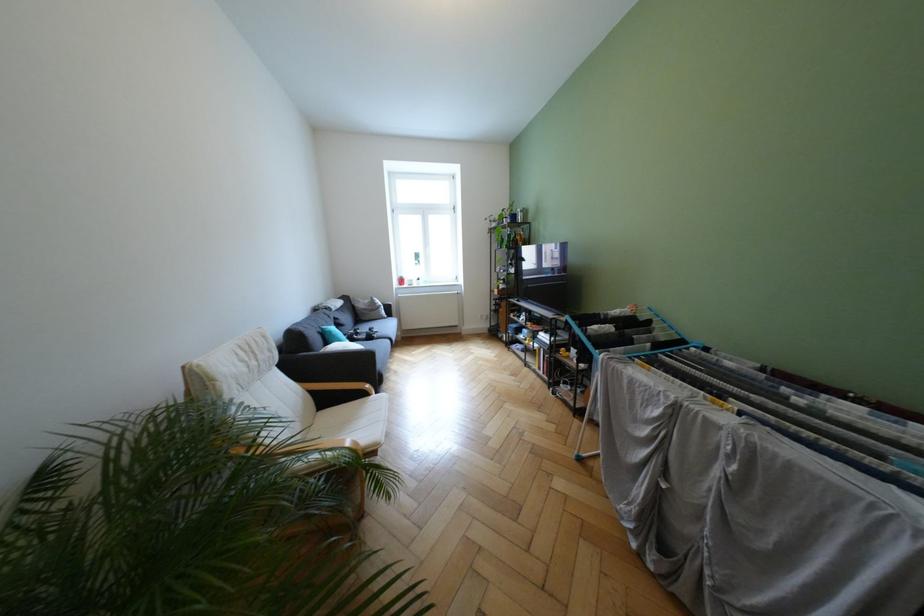
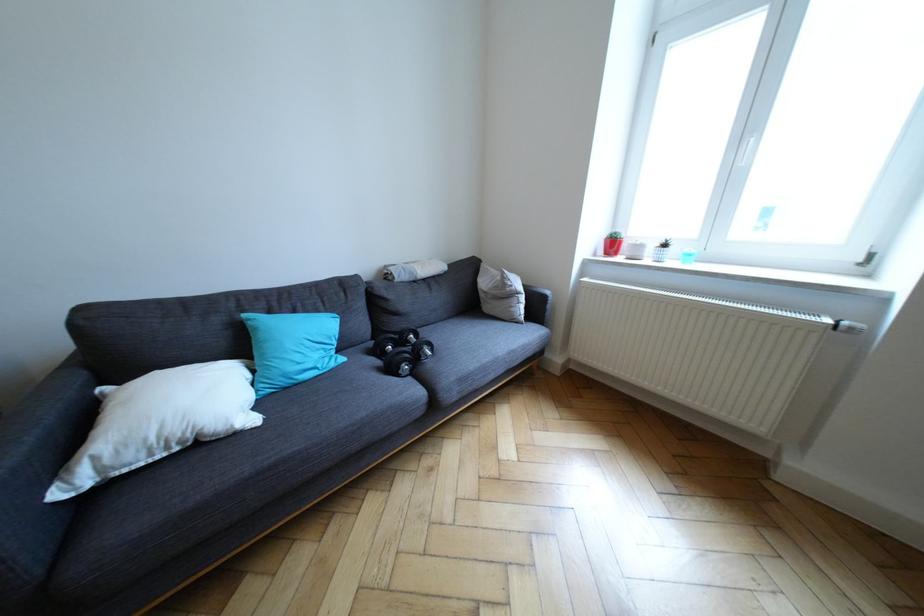
Locate, in the second image, the point that corresponds to the point at 333,329 in the first image.

(254, 315)